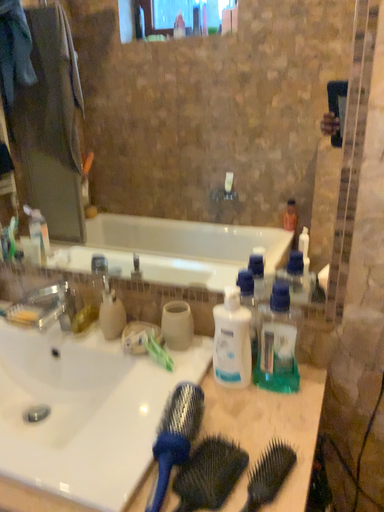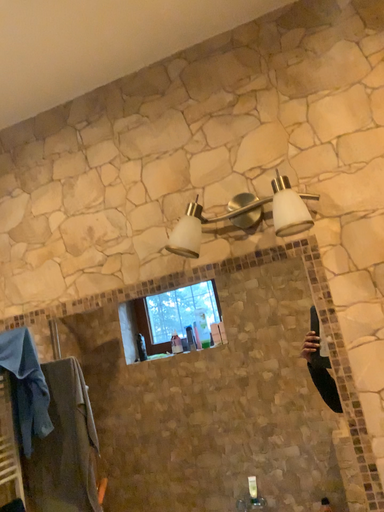
Question: Which way did the camera rotate in the video?

Choices:
 (A) rotated upward
 (B) rotated downward

Answer: (A)